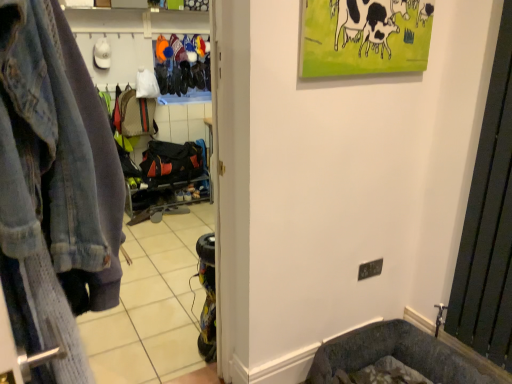
Question: Should I look upward or downward to see faded denim jacket at left?

Choices:
 (A) down
 (B) up

Answer: (A)

Question: Considering the relative sizes of faded denim jacket at left and black metal radiator at right in the image provided, is faded denim jacket at left bigger than black metal radiator at right?

Choices:
 (A) no
 (B) yes

Answer: (B)

Question: Is faded denim jacket at left oriented towards black metal radiator at right?

Choices:
 (A) yes
 (B) no

Answer: (A)

Question: Does faded denim jacket at left appear on the right side of black metal radiator at right?

Choices:
 (A) no
 (B) yes

Answer: (A)

Question: From the image's perspective, is faded denim jacket at left on black metal radiator at right?

Choices:
 (A) no
 (B) yes

Answer: (B)

Question: Is faded denim jacket at left to the left of black metal radiator at right from the viewer's perspective?

Choices:
 (A) no
 (B) yes

Answer: (B)

Question: Does faded denim jacket at left lie in front of black metal radiator at right?

Choices:
 (A) no
 (B) yes

Answer: (B)

Question: Is black metal radiator at right shorter than faded denim jacket at left?

Choices:
 (A) no
 (B) yes

Answer: (A)

Question: From the image's perspective, would you say black metal radiator at right is positioned over faded denim jacket at left?

Choices:
 (A) yes
 (B) no

Answer: (B)

Question: Is faded denim jacket at left at the back of black metal radiator at right?

Choices:
 (A) yes
 (B) no

Answer: (B)

Question: Is black metal radiator at right closer to the viewer compared to faded denim jacket at left?

Choices:
 (A) yes
 (B) no

Answer: (B)

Question: Can you confirm if black metal radiator at right is positioned to the right of faded denim jacket at left?

Choices:
 (A) no
 (B) yes

Answer: (B)

Question: Could you tell me if black metal radiator at right is facing faded denim jacket at left?

Choices:
 (A) no
 (B) yes

Answer: (A)

Question: Would you say black metal radiator at right is outside faded denim jacket at left?

Choices:
 (A) no
 (B) yes

Answer: (B)